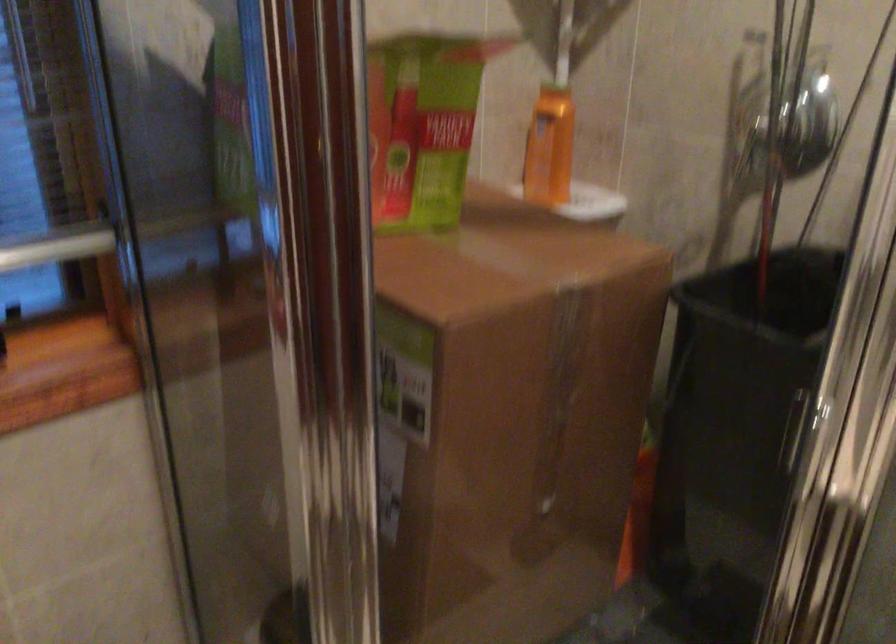
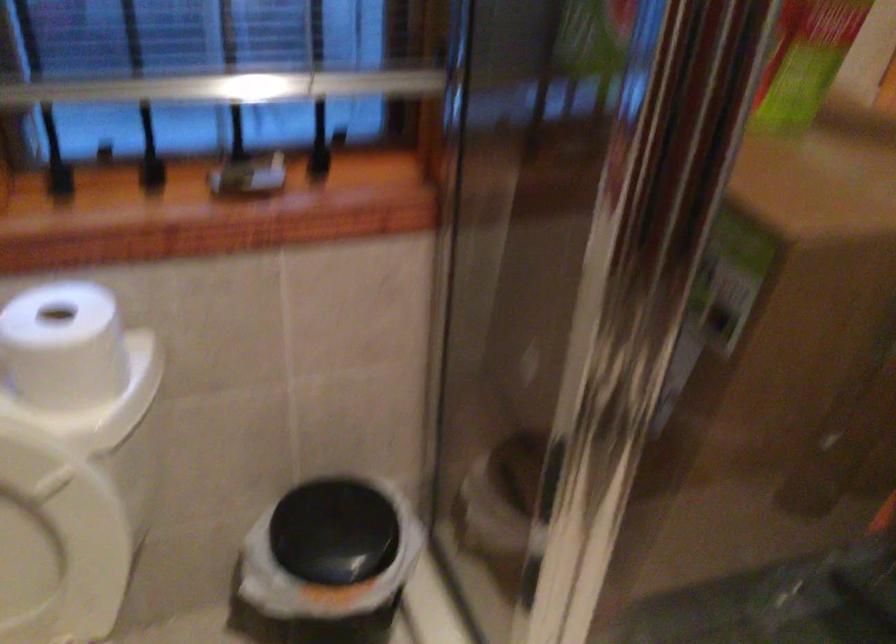
Question: The camera is either moving clockwise (left) or counter-clockwise (right) around the object. The first image is from the beginning of the video and the second image is from the end. Is the camera moving left or right when shooting the video?

Choices:
 (A) Left
 (B) Right

Answer: (B)